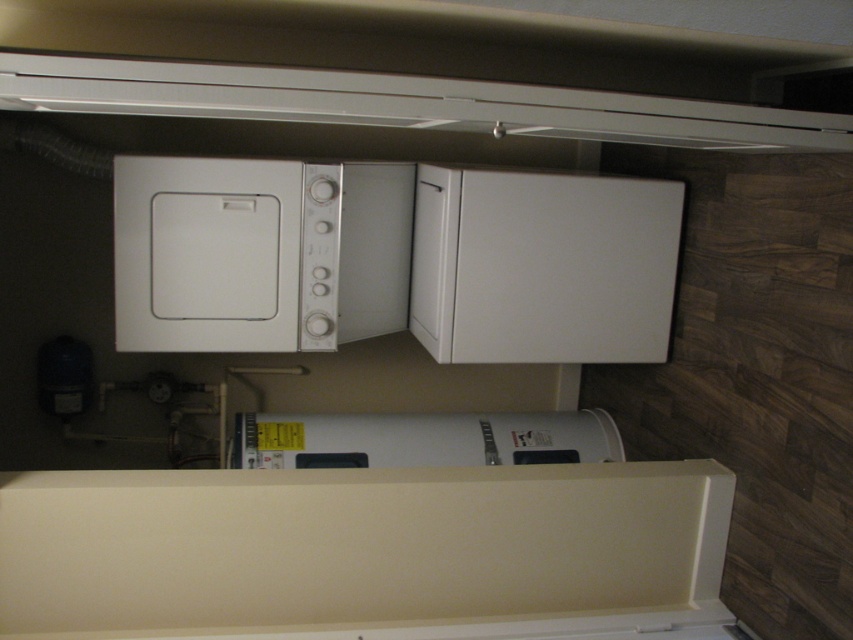
Question: Among these points, which one is farthest from the camera?

Choices:
 (A) (352, 456)
 (B) (345, 321)
 (C) (576, 99)

Answer: (B)

Question: In this image, where is white matte exhaust hood at upper center located relative to white matte water heater at center?

Choices:
 (A) left
 (B) right

Answer: (B)

Question: Can you confirm if white matte exhaust hood at upper center is thinner than white matte water heater at center?

Choices:
 (A) yes
 (B) no

Answer: (B)

Question: Which point appears closest to the camera in this image?

Choices:
 (A) (281, 316)
 (B) (308, 438)

Answer: (A)

Question: Which of the following is the farthest from the observer?

Choices:
 (A) (618, 444)
 (B) (200, 252)
 (C) (26, 76)

Answer: (A)

Question: Can you confirm if white matte exhaust hood at upper center is positioned below white matte water heater at center?

Choices:
 (A) yes
 (B) no

Answer: (B)